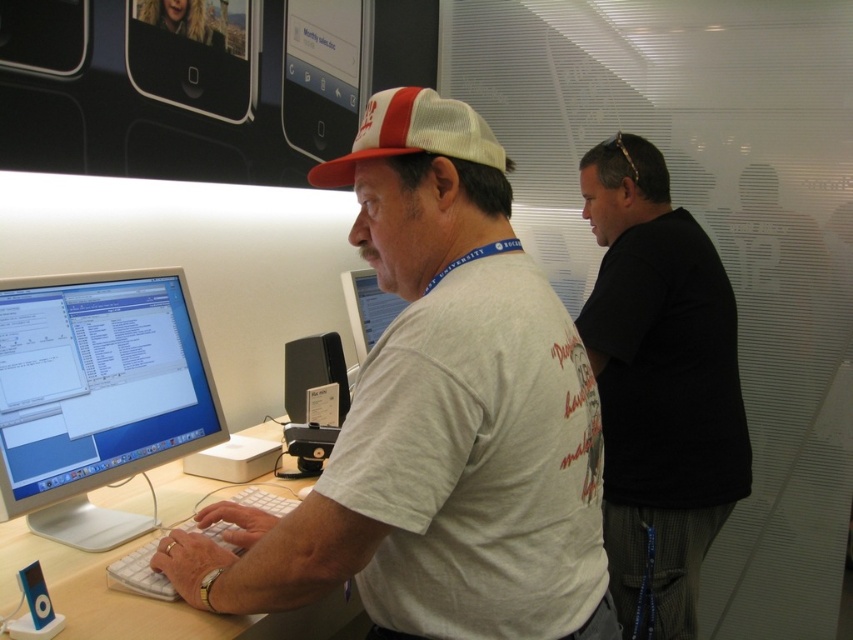
Question: Which object is positioned farthest from the matte white monitor at center?

Choices:
 (A) white cotton t-shirt at center
 (B) white mesh baseball cap at center
 (C) black matte shirt at right
 (D) white plastic table at center

Answer: (A)

Question: In this image, where is white plastic table at center located relative to matte white monitor at center?

Choices:
 (A) below
 (B) above

Answer: (A)

Question: Can you confirm if black matte shirt at right is smaller than white glossy computer monitor at center?

Choices:
 (A) no
 (B) yes

Answer: (A)

Question: Can you confirm if white plastic table at center is smaller than black plastic speaker at center?

Choices:
 (A) yes
 (B) no

Answer: (B)

Question: Estimate the real-world distances between objects in this image. Which object is farther from the white glossy computer monitor at center?

Choices:
 (A) white mesh baseball cap at center
 (B) matte white monitor at center

Answer: (B)

Question: Which point is closer to the camera taking this photo?

Choices:
 (A) (346, 292)
 (B) (680, 369)
 (C) (22, 316)

Answer: (C)